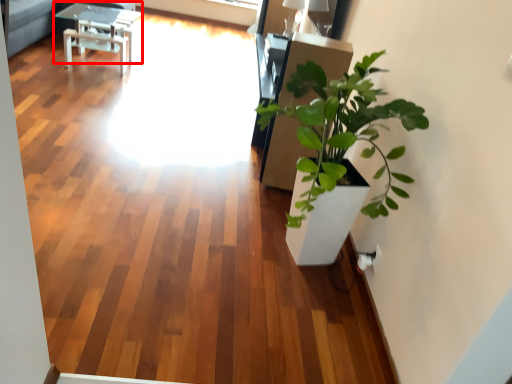
Question: From the image's perspective, where is table (annotated by the red box) located relative to window screen?

Choices:
 (A) below
 (B) above

Answer: (A)